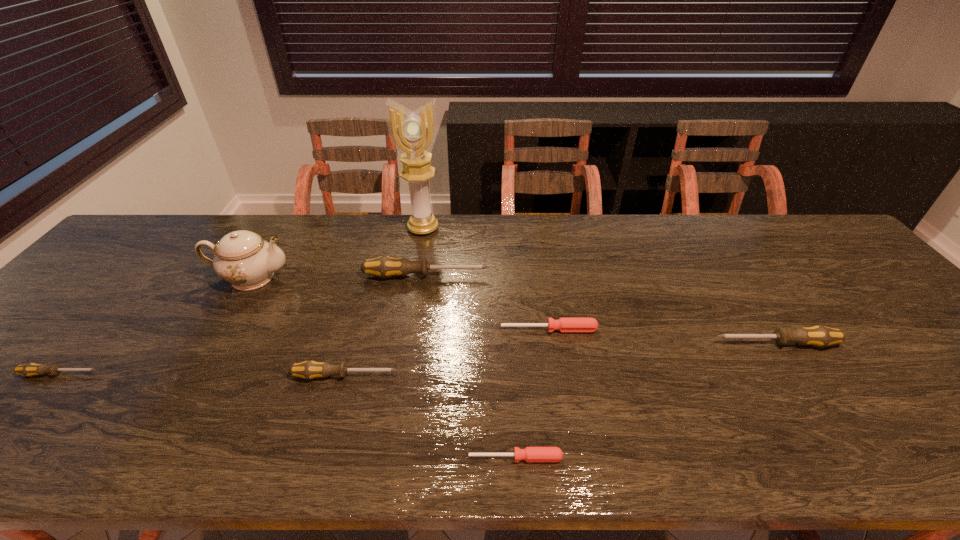
Find the location of a particular element. award is located at coordinates (413, 133).

At what (x,y) coordinates should I click in order to perform the action: click on the tallest object. Please return your answer as a coordinate pair (x, y). This screenshot has height=540, width=960. Looking at the image, I should click on (413, 133).

This screenshot has height=540, width=960. Identify the location of the seventh object from right to left. (243, 258).

In order to click on chinaware in this screenshot , I will do `click(243, 258)`.

The width and height of the screenshot is (960, 540). In order to click on the sixth shortest object in this screenshot , I will do `click(384, 267)`.

The image size is (960, 540). I want to click on the biggest gray screwdriver, so click(384, 267).

Locate an element on the screen. the rightmost screwdriver is located at coordinates (820, 336).

Find the location of a particular element. The height and width of the screenshot is (540, 960). the rightmost gray screwdriver is located at coordinates (820, 336).

Locate an element on the screen. the fourth shortest object is located at coordinates (310, 369).

The image size is (960, 540). In order to click on the second smallest gray screwdriver in this screenshot , I will do `click(310, 369)`.